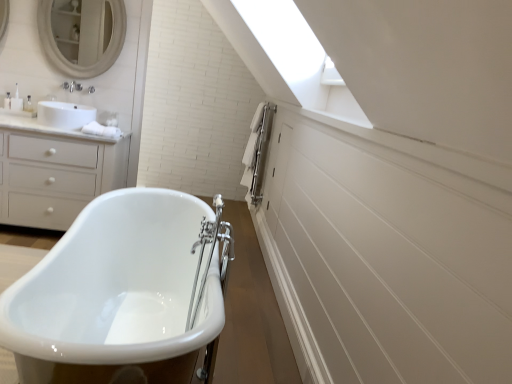
Question: In terms of size, does white matte mirror at upper left appear bigger or smaller than white matte chest of drawers at left?

Choices:
 (A) big
 (B) small

Answer: (B)

Question: From the image's perspective, is white matte mirror at upper left above or below white matte chest of drawers at left?

Choices:
 (A) below
 (B) above

Answer: (B)

Question: Based on their relative distances, which object is nearer to the white glossy bathtub at center?

Choices:
 (A) white matte mirror at upper left
 (B) white matte chest of drawers at left

Answer: (B)

Question: Considering the real-world distances, which object is farthest from the white matte chest of drawers at left?

Choices:
 (A) white glossy bathtub at center
 (B) white matte mirror at upper left

Answer: (A)